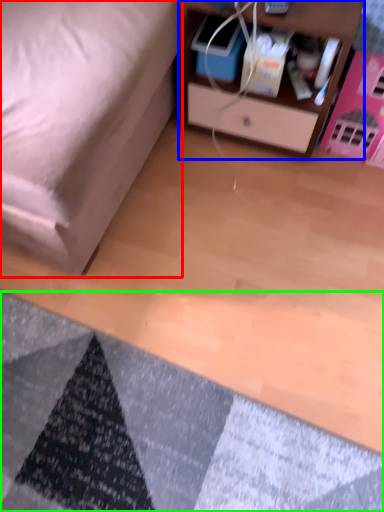
Question: Which is farther away from furniture (highlighted by a red box)? nightstand (highlighted by a blue box) or mat (highlighted by a green box)?

Choices:
 (A) nightstand
 (B) mat

Answer: (B)